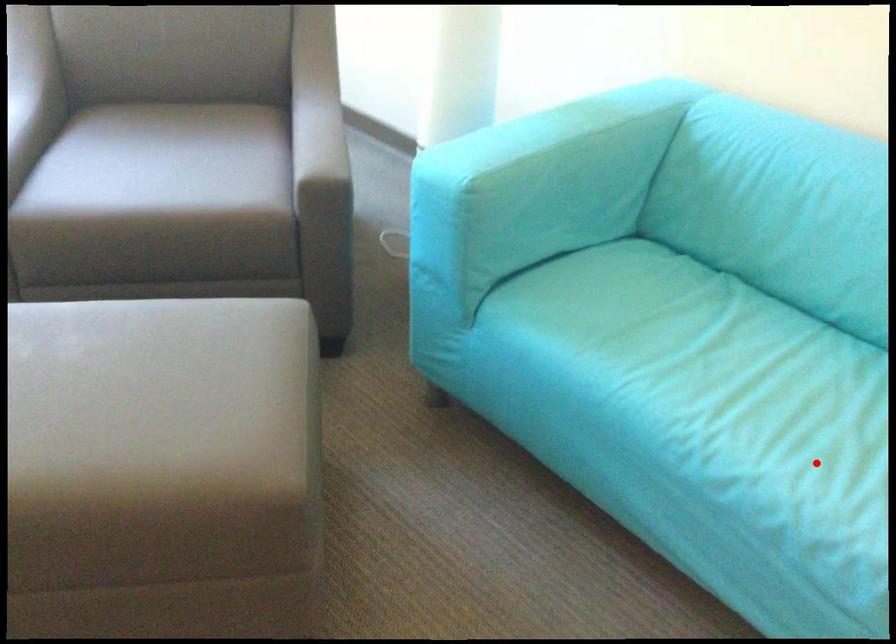
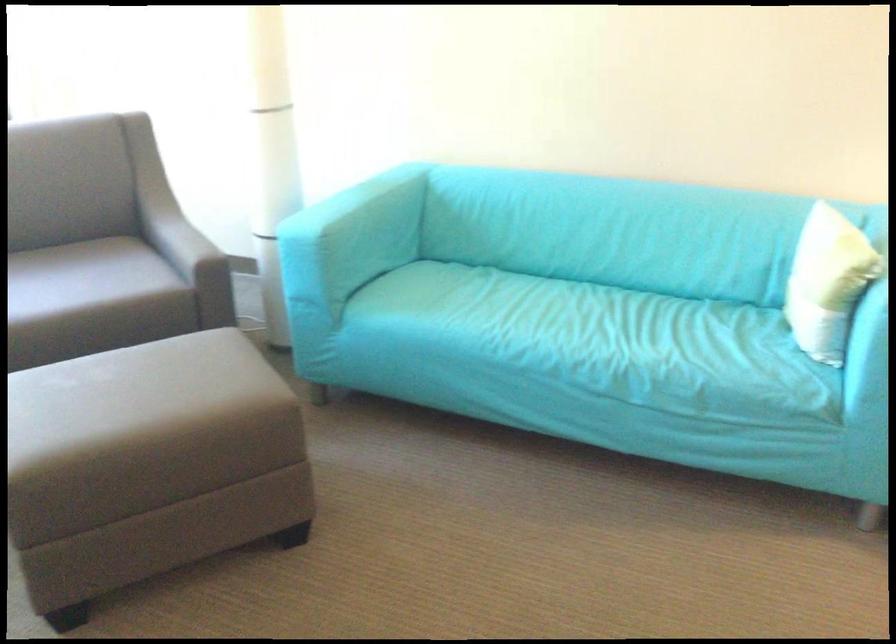
Question: I am providing you with two images of the same scene from different viewpoints. Given a red point in image1, look at the same physical point in image2. Is it:

Choices:
 (A) Closer to the viewpoint
 (B) Farther from the viewpoint

Answer: (B)